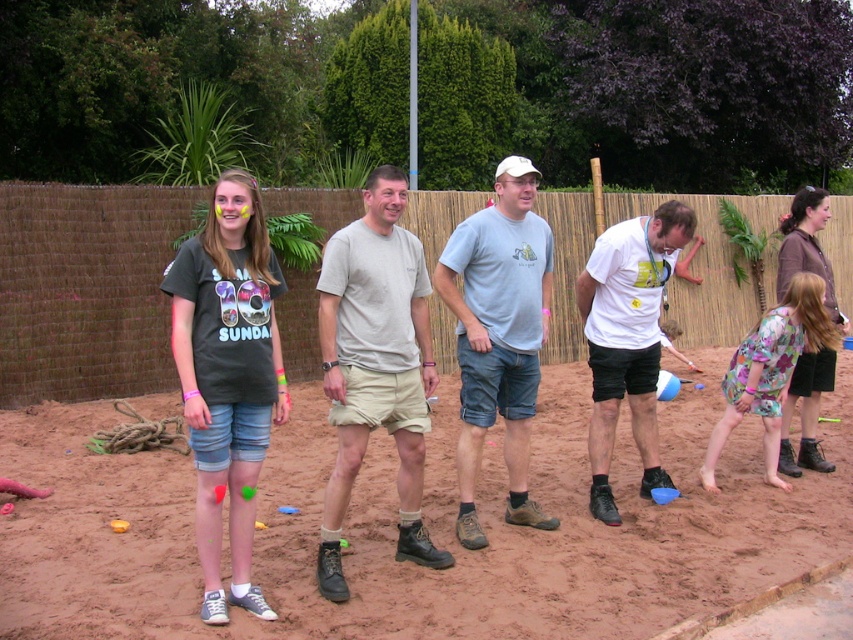
Question: From the image, what is the correct spatial relationship of dark gray t-shirt at left in relation to light gray cotton t-shirt at center?

Choices:
 (A) left
 (B) right

Answer: (B)

Question: Does dark gray t-shirt at left appear on the left side of light gray cotton t-shirt at center?

Choices:
 (A) yes
 (B) no

Answer: (B)

Question: Which object is the farthest from the dark gray t-shirt at left?

Choices:
 (A) light gray t-shirt at center
 (B) white matte t-shirt at center

Answer: (B)

Question: Where is light gray cotton t-shirt at center located in relation to light gray t-shirt at center in the image?

Choices:
 (A) right
 (B) left

Answer: (B)

Question: Among these points, which one is nearest to the camera?

Choices:
 (A) [693, 216]
 (B) [402, 317]
 (C) [369, 301]

Answer: (C)

Question: Among these objects, which one is nearest to the camera?

Choices:
 (A) light gray t-shirt at center
 (B) white matte t-shirt at center
 (C) light gray cotton t-shirt at center
 (D) dark gray t-shirt at left

Answer: (D)